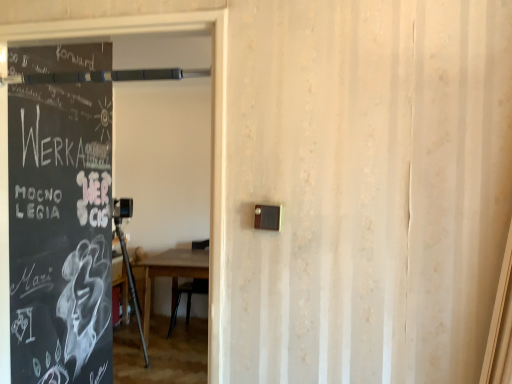
Question: From the image's perspective, is black chalkboard at left above wooden table at center?

Choices:
 (A) yes
 (B) no

Answer: (A)

Question: Is black chalkboard at left oriented towards wooden table at center?

Choices:
 (A) no
 (B) yes

Answer: (A)

Question: Does black chalkboard at left have a smaller size compared to wooden table at center?

Choices:
 (A) yes
 (B) no

Answer: (A)

Question: Considering the relative sizes of black chalkboard at left and wooden table at center in the image provided, is black chalkboard at left thinner than wooden table at center?

Choices:
 (A) yes
 (B) no

Answer: (A)

Question: Does black chalkboard at left have a larger size compared to wooden table at center?

Choices:
 (A) no
 (B) yes

Answer: (A)

Question: Is black chalkboard at left to the left of wooden table at center from the viewer's perspective?

Choices:
 (A) no
 (B) yes

Answer: (A)

Question: Is wooden table at center far away from black chalkboard at left?

Choices:
 (A) no
 (B) yes

Answer: (B)

Question: Can you see wooden table at center touching black chalkboard at left?

Choices:
 (A) no
 (B) yes

Answer: (A)

Question: Is the depth of wooden table at center greater than that of black chalkboard at left?

Choices:
 (A) no
 (B) yes

Answer: (B)

Question: Is black chalkboard at left located within wooden table at center?

Choices:
 (A) yes
 (B) no

Answer: (B)

Question: From the image's perspective, is wooden table at center under black chalkboard at left?

Choices:
 (A) yes
 (B) no

Answer: (A)

Question: Can we say wooden table at center lies outside black chalkboard at left?

Choices:
 (A) no
 (B) yes

Answer: (B)

Question: Considering the positions of black chalkboard at left and wooden table at center in the image, is black chalkboard at left taller or shorter than wooden table at center?

Choices:
 (A) short
 (B) tall

Answer: (B)